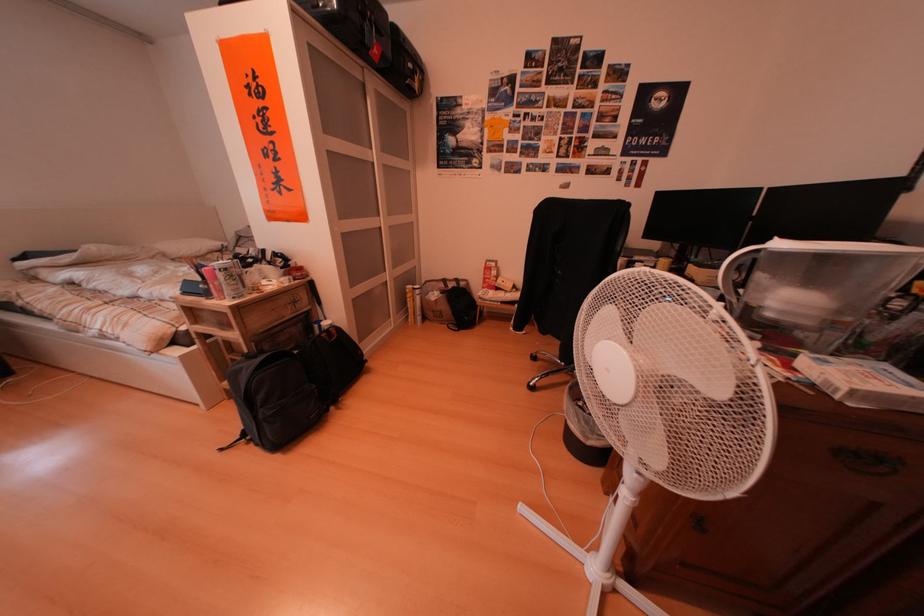
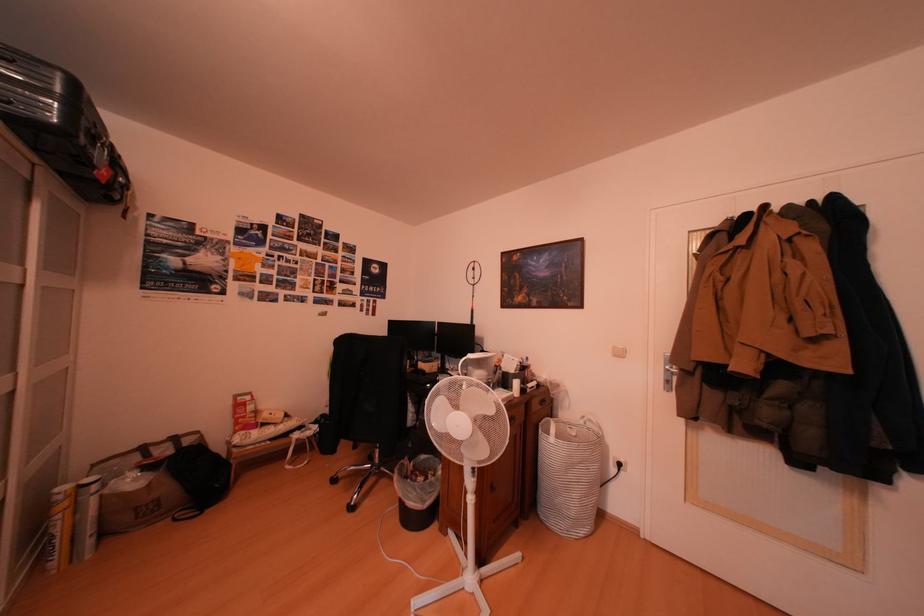
Where in the second image is the point corresponding to the point at 458,292 from the first image?

(161, 461)